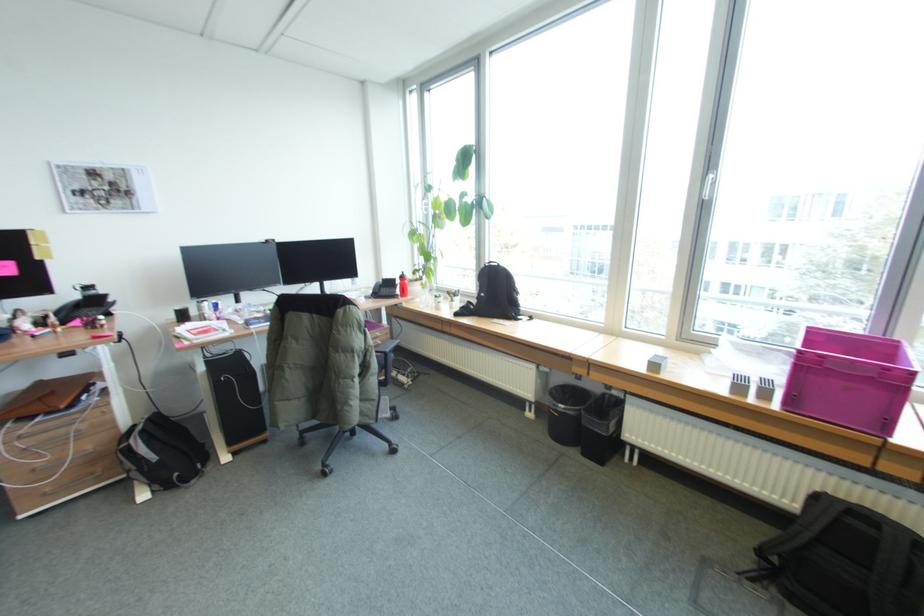
The height and width of the screenshot is (616, 924). What do you see at coordinates (709, 185) in the screenshot?
I see `a white window handle` at bounding box center [709, 185].